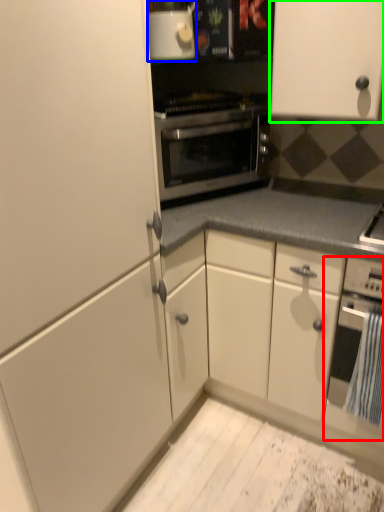
Question: Which object is the farthest from oven (highlighted by a red box)? Choose among these: appliance (highlighted by a blue box) or cabinetry (highlighted by a green box).

Choices:
 (A) appliance
 (B) cabinetry

Answer: (A)